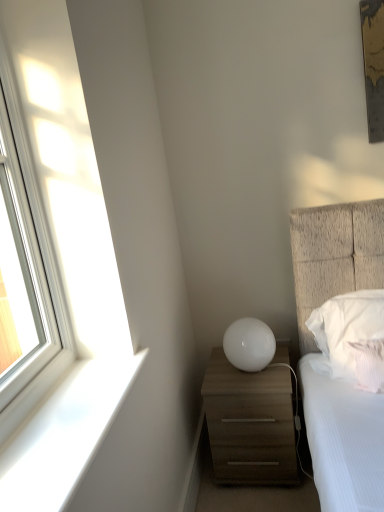
Question: From the image's perspective, is white textured pillow at right, which is the second pillow from back to front, over white glossy sphere at center?

Choices:
 (A) yes
 (B) no

Answer: (B)

Question: Is white textured pillow at right, which is the second pillow from back to front, facing away from white glossy sphere at center?

Choices:
 (A) yes
 (B) no

Answer: (B)

Question: Is white textured pillow at right, which is the second pillow from back to front, touching white glossy sphere at center?

Choices:
 (A) no
 (B) yes

Answer: (A)

Question: Is there a large distance between white textured pillow at right, arranged as the first pillow when viewed from the front, and white glossy sphere at center?

Choices:
 (A) no
 (B) yes

Answer: (A)

Question: From a real-world perspective, is white textured pillow at right, which is the second pillow from back to front, over white glossy sphere at center?

Choices:
 (A) no
 (B) yes

Answer: (A)

Question: Is white textured pillow at right, arranged as the first pillow when viewed from the front, taller or shorter than white soft pillow at right, placed as the first pillow when sorted from back to front?

Choices:
 (A) short
 (B) tall

Answer: (A)

Question: Is white textured pillow at right, which is the second pillow from back to front, in front of or behind white soft pillow at right, the second pillow from the front, in the image?

Choices:
 (A) behind
 (B) front

Answer: (B)

Question: From a real-world perspective, is white textured pillow at right, which is the second pillow from back to front, physically located above or below white soft pillow at right, placed as the first pillow when sorted from back to front?

Choices:
 (A) above
 (B) below

Answer: (B)

Question: Looking at the image, does white textured pillow at right, arranged as the first pillow when viewed from the front, seem bigger or smaller compared to white soft pillow at right, placed as the first pillow when sorted from back to front?

Choices:
 (A) small
 (B) big

Answer: (A)

Question: Based on their sizes in the image, would you say clear glass window at left is bigger or smaller than white textured pillow at right, arranged as the first pillow when viewed from the front?

Choices:
 (A) small
 (B) big

Answer: (B)

Question: From the image's perspective, is clear glass window at left positioned above or below white textured pillow at right, which is the second pillow from back to front?

Choices:
 (A) below
 (B) above

Answer: (B)

Question: From a real-world perspective, is clear glass window at left above or below white textured pillow at right, arranged as the first pillow when viewed from the front?

Choices:
 (A) below
 (B) above

Answer: (B)

Question: Considering their positions, is clear glass window at left located in front of or behind white textured pillow at right, arranged as the first pillow when viewed from the front?

Choices:
 (A) behind
 (B) front

Answer: (B)

Question: Based on their sizes in the image, would you say clear glass window at left is bigger or smaller than white soft pillow at right, placed as the first pillow when sorted from back to front?

Choices:
 (A) big
 (B) small

Answer: (A)

Question: In the image, is clear glass window at left positioned in front of or behind white soft pillow at right, the second pillow from the front?

Choices:
 (A) front
 (B) behind

Answer: (A)